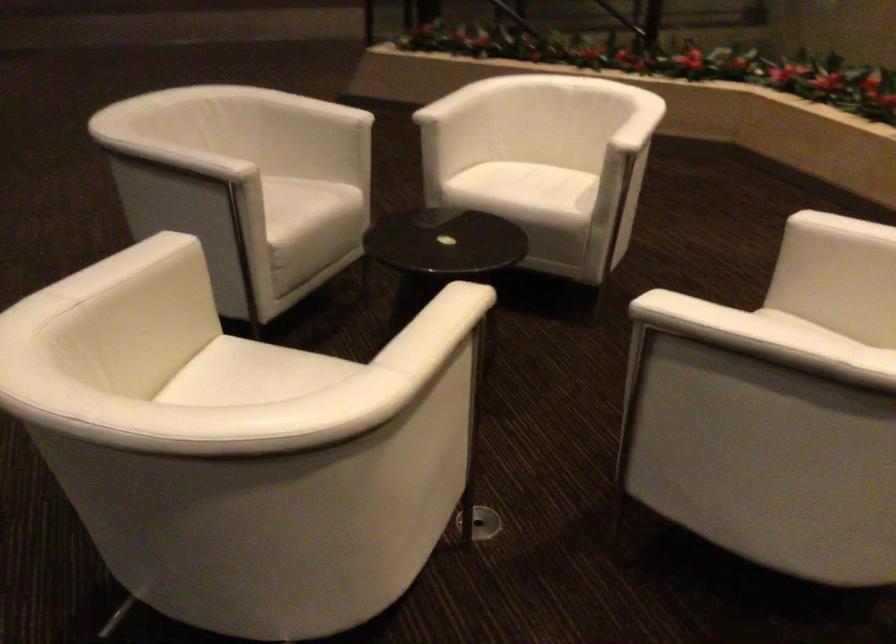
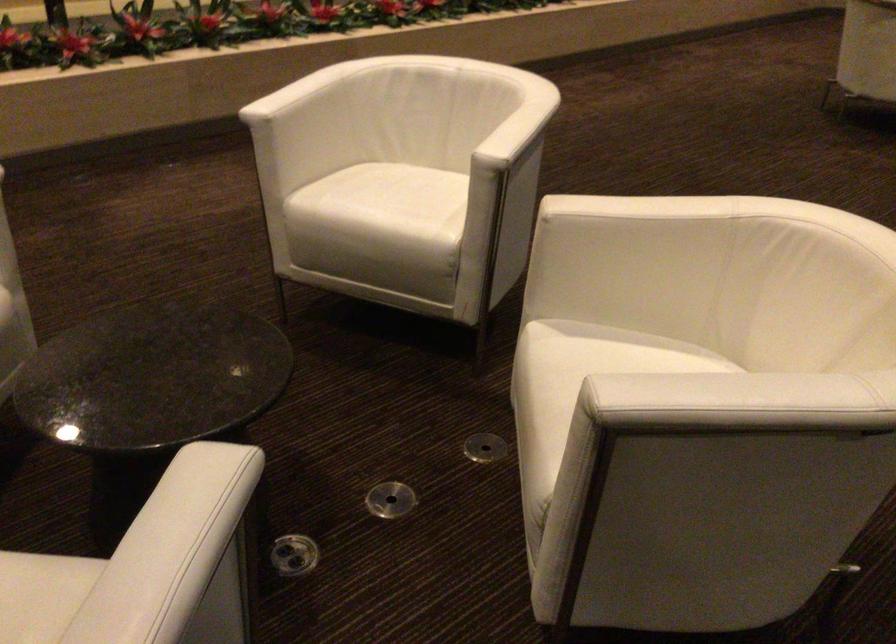
In the second image, find the point that corresponds to the point at 734,314 in the first image.

(515, 122)